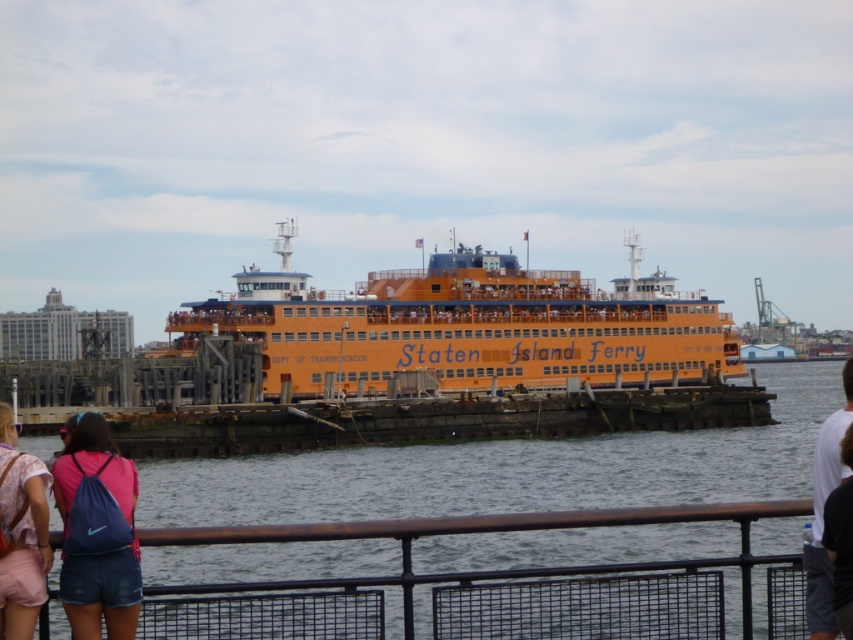
Is orange matte staten island ferry at center to the right of pink fabric backpack at lower left from the viewer's perspective?

Indeed, orange matte staten island ferry at center is positioned on the right side of pink fabric backpack at lower left.

Which is above, orange matte staten island ferry at center or pink fabric backpack at lower left?

orange matte staten island ferry at center is above.

Describe the element at coordinates (460, 326) in the screenshot. I see `orange matte staten island ferry at center` at that location.

At what (x,y) coordinates should I click in order to perform the action: click on orange matte staten island ferry at center. Please return your answer as a coordinate pair (x, y). Looking at the image, I should click on (460, 326).

Who is more forward, (492, 378) or (848, 524)?

Positioned in front is point (848, 524).

Who is more distant from viewer, [634,248] or [834,612]?

Point [634,248]

Where is `orange matte staten island ferry at center`? This screenshot has width=853, height=640. orange matte staten island ferry at center is located at coordinates (460, 326).

Is denim shorts at lower left below pink fabric backpack at lower left?

Yes, denim shorts at lower left is below pink fabric backpack at lower left.

In order to click on denim shorts at lower left in this screenshot , I will do coord(97,531).

Identify the location of denim shorts at lower left. (97, 531).